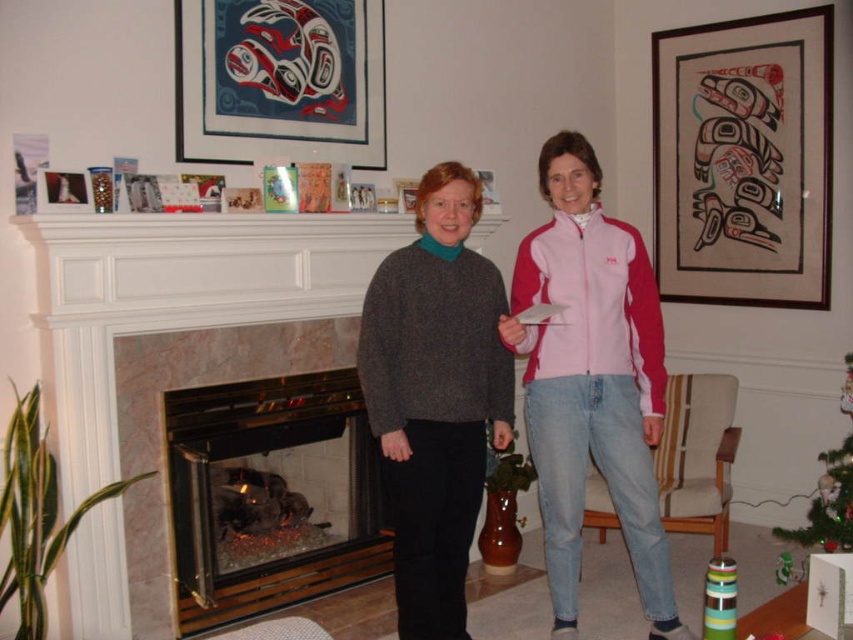
Question: Observing the image, what is the correct spatial positioning of wooden framed artwork at upper right in reference to knitted gray sweater at center?

Choices:
 (A) right
 (B) left

Answer: (A)

Question: Which of the following is the closest to the observer?

Choices:
 (A) (648, 461)
 (B) (291, 90)
 (C) (426, 634)
 (D) (833, 493)

Answer: (C)

Question: Which of these objects is positioned farthest from the knitted gray sweater at center?

Choices:
 (A) pink fleece jacket at center
 (B) matte plastic picture frame at upper center

Answer: (B)

Question: Does knitted gray sweater at center lie in front of green matte christmas tree at lower right?

Choices:
 (A) yes
 (B) no

Answer: (A)

Question: Considering the relative positions of wooden framed artwork at upper right and green matte christmas tree at lower right in the image provided, where is wooden framed artwork at upper right located with respect to green matte christmas tree at lower right?

Choices:
 (A) right
 (B) left

Answer: (B)

Question: Which object is closer to the camera taking this photo?

Choices:
 (A) knitted gray sweater at center
 (B) pink fleece jacket at center

Answer: (B)